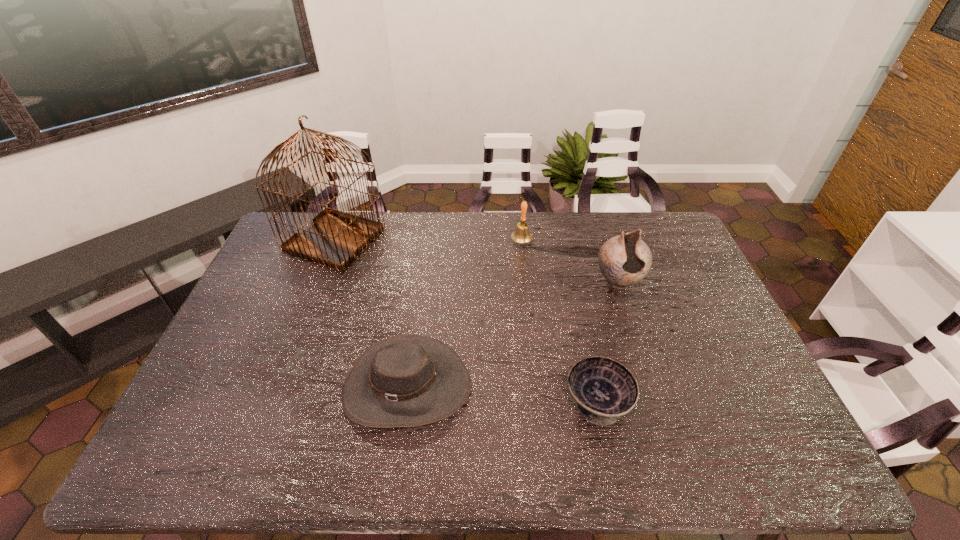
Identify the location of vacant space in between the third object from left to right and the bowl. (560, 322).

The image size is (960, 540). I want to click on object that is the second closest to the shortest object, so click(x=624, y=260).

Locate which object ranks fourth in proximity to the cowboy hat. Please provide its 2D coordinates. Your answer should be formatted as a tuple, i.e. [(x, y)], where the tuple contains the x and y coordinates of a point satisfying the conditions above.

[(521, 235)]